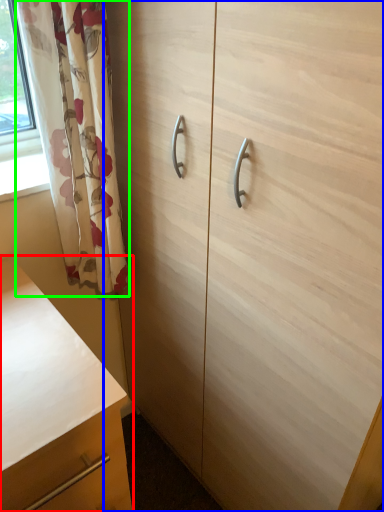
Question: Based on their relative distances, which object is farther from chest of drawers (highlighted by a red box)? Choose from cabinetry (highlighted by a blue box) and curtain (highlighted by a green box).

Choices:
 (A) cabinetry
 (B) curtain

Answer: (A)